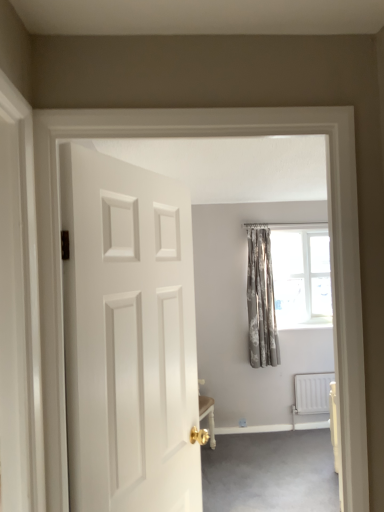
You are a GUI agent. You are given a task and a screenshot of the screen. Output one action in this format:
    pyautogui.click(x=<x>, y=<y>)
    Task: Click on the vacant location below silver textured curtains at center (from a real-world perspective)
    The width and height of the screenshot is (384, 512).
    Given the screenshot: What is the action you would take?
    pyautogui.click(x=268, y=433)